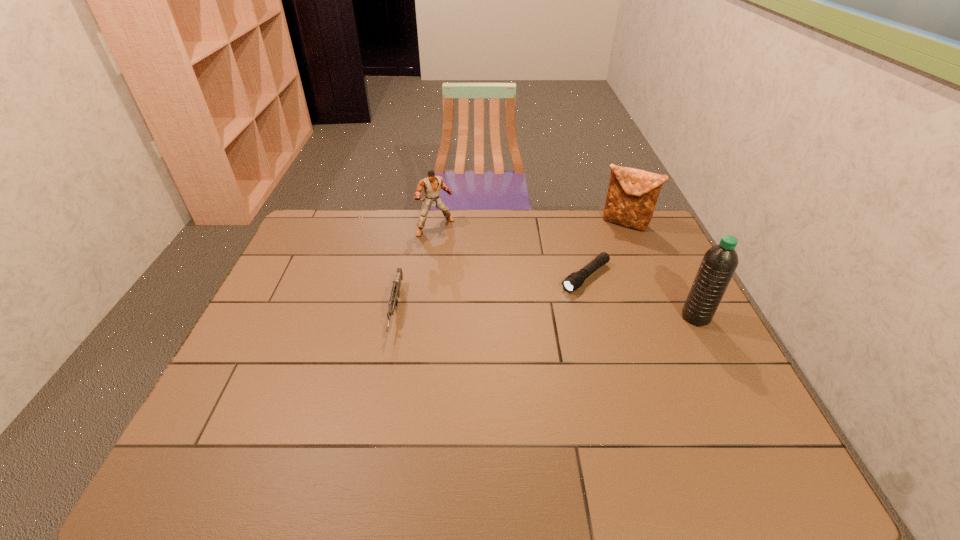
Locate an element on the screen. vacant space situated at the lens end of the third object from right to left is located at coordinates (487, 356).

At what (x,y) coordinates should I click in order to perform the action: click on free space located 0.170m at the lens end of the third object from right to left. Please return your answer as a coordinate pair (x, y). Looking at the image, I should click on (533, 319).

Locate an element on the screen. The image size is (960, 540). free location located on the front-facing side of the puncher is located at coordinates (486, 288).

Identify the location of vacant position located 0.130m on the front-facing side of the puncher. The width and height of the screenshot is (960, 540). (459, 256).

Find the location of `vacant space located 0.200m on the front-facing side of the puncher`. vacant space located 0.200m on the front-facing side of the puncher is located at coordinates (468, 268).

In order to click on vacant space situated on the open side of the clutch bag in this screenshot , I will do coord(574,284).

In order to click on vacant space located on the open side of the clutch bag in this screenshot , I will do `click(591, 262)`.

Where is `vacant space situated on the open side of the clutch bag`? The width and height of the screenshot is (960, 540). vacant space situated on the open side of the clutch bag is located at coordinates (585, 271).

The image size is (960, 540). Identify the location of puncher present at the far edge. (431, 184).

The width and height of the screenshot is (960, 540). What are the coordinates of `clutch bag that is at the far edge` in the screenshot? It's located at (632, 195).